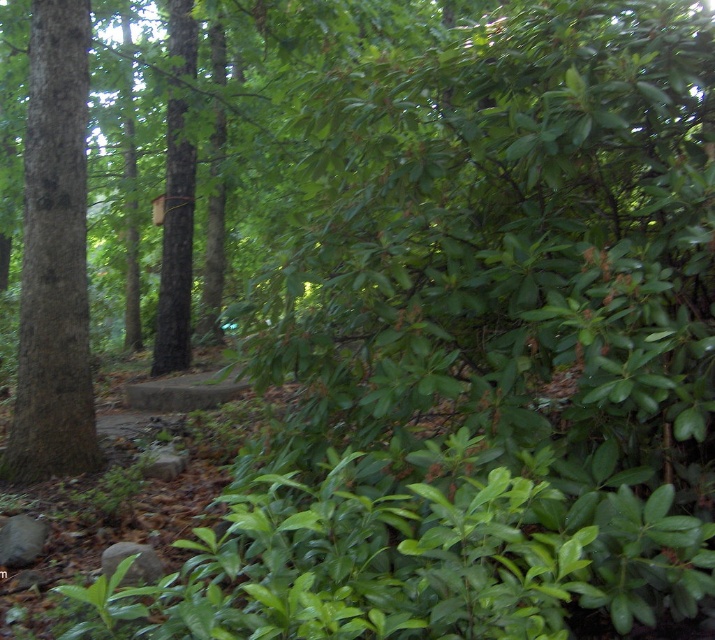
Question: Which object appears closest to the camera in this image?

Choices:
 (A) brown wood birdhouse at center
 (B) smooth brown tree trunk at left

Answer: (B)

Question: Is smooth brown tree trunk at left to the right of brown wood birdhouse at center from the viewer's perspective?

Choices:
 (A) no
 (B) yes

Answer: (B)

Question: Can you confirm if smooth brown tree trunk at left is positioned to the left of brown wood birdhouse at center?

Choices:
 (A) yes
 (B) no

Answer: (B)

Question: Which of the following is the closest to the observer?

Choices:
 (A) smooth brown tree trunk at left
 (B) brown wood birdhouse at center

Answer: (A)

Question: Does smooth brown tree trunk at left have a larger size compared to brown wood birdhouse at center?

Choices:
 (A) yes
 (B) no

Answer: (B)